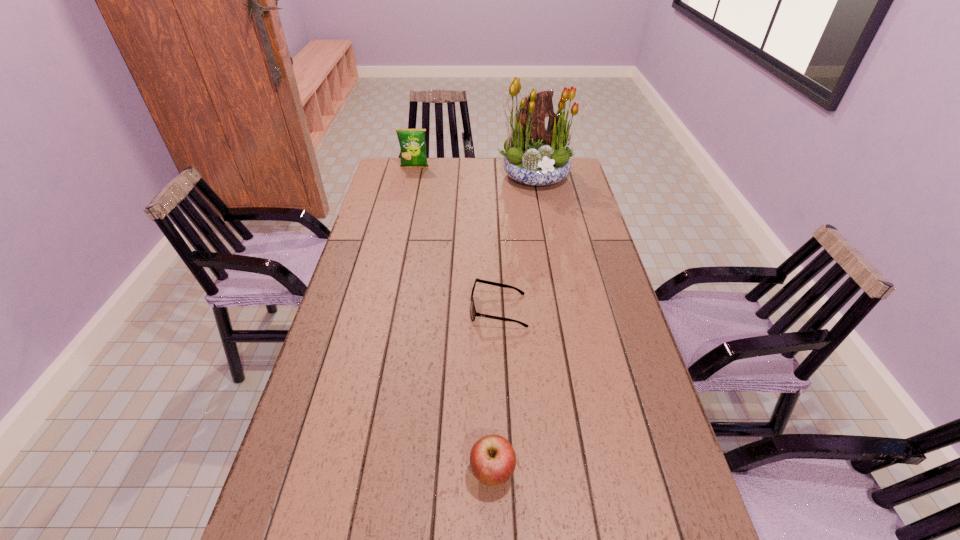
The height and width of the screenshot is (540, 960). Identify the location of free area in between the flower arrangement and the second tallest object. (476, 172).

Identify which object is the third closest to the leftmost object. Please provide its 2D coordinates. Your answer should be formatted as a tuple, i.e. [(x, y)], where the tuple contains the x and y coordinates of a point satisfying the conditions above.

[(492, 458)]

This screenshot has height=540, width=960. I want to click on object that is the third closest to the third tallest object, so click(412, 142).

Identify the location of free space that satisfies the following two spatial constraints: 1. on the front-facing side of the tallest object; 2. on the front-facing side of the sunglasses. The height and width of the screenshot is (540, 960). (564, 309).

Identify the location of vacant point that satisfies the following two spatial constraints: 1. on the front-facing side of the leftmost object; 2. on the right side of the apple. (346, 473).

Image resolution: width=960 pixels, height=540 pixels. I want to click on vacant region that satisfies the following two spatial constraints: 1. on the front-facing side of the tallest object; 2. on the front-facing side of the shortest object, so click(564, 309).

Where is `blank area in the image that satisfies the following two spatial constraints: 1. on the front-facing side of the apple; 2. on the right side of the crisp (potato chip)`? Image resolution: width=960 pixels, height=540 pixels. blank area in the image that satisfies the following two spatial constraints: 1. on the front-facing side of the apple; 2. on the right side of the crisp (potato chip) is located at coordinates (346, 473).